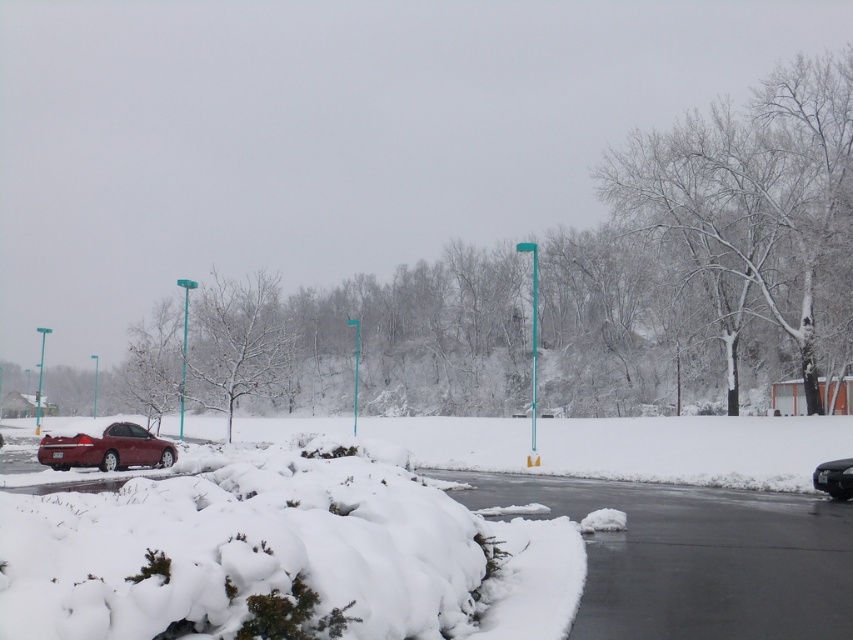
Is shiny red sedan at left shorter than shiny black sedan at lower right?

No.

Can you confirm if shiny red sedan at left is positioned below shiny black sedan at lower right?

Incorrect, shiny red sedan at left is not positioned below shiny black sedan at lower right.

The height and width of the screenshot is (640, 853). What do you see at coordinates (106, 449) in the screenshot?
I see `shiny red sedan at left` at bounding box center [106, 449].

Where is `shiny red sedan at left`? shiny red sedan at left is located at coordinates 106,449.